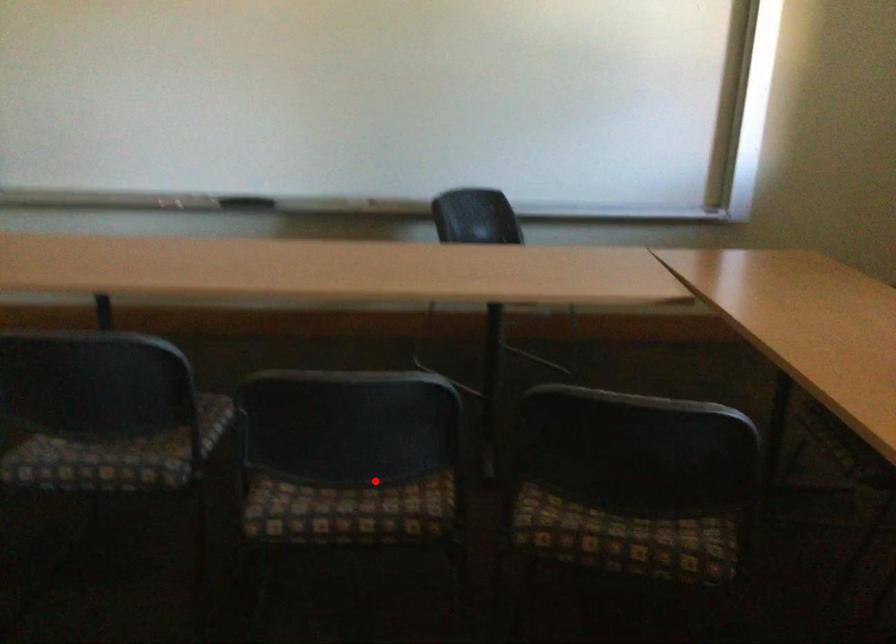
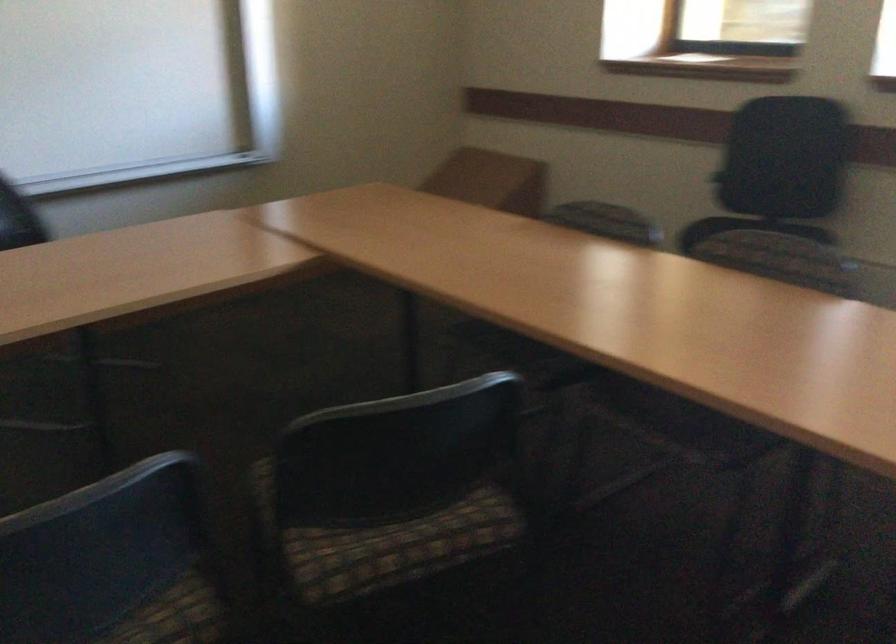
In the second image, find the point that corresponds to the highlighted location in the first image.

(117, 608)